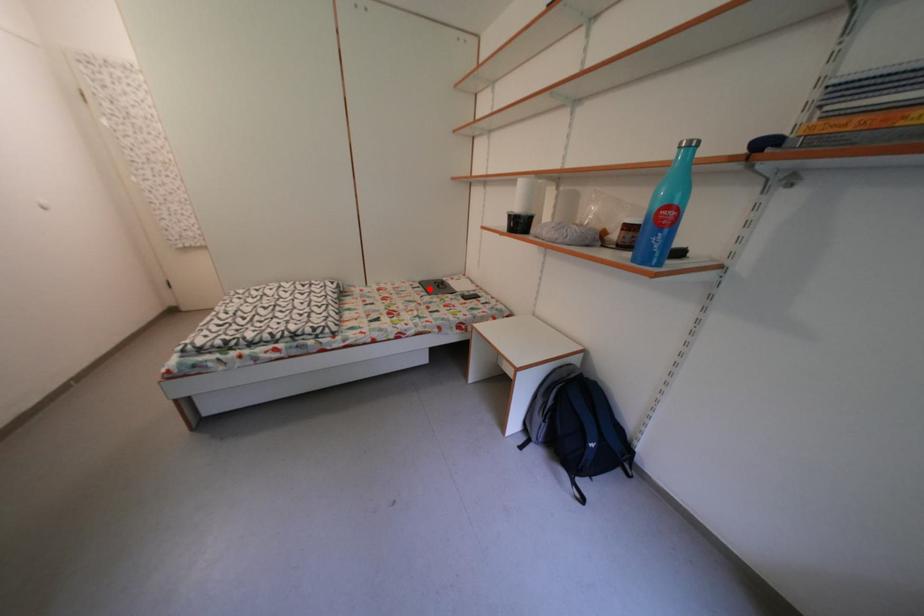
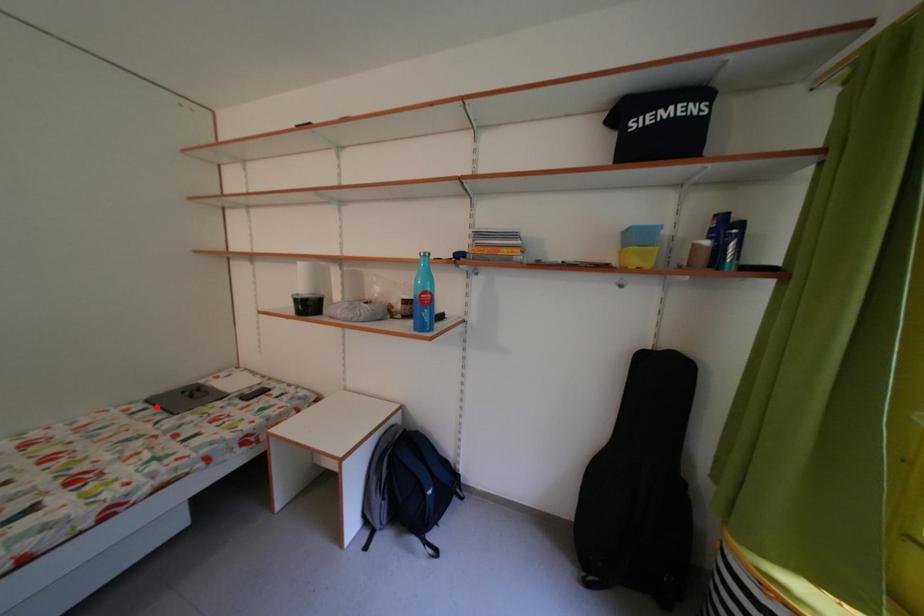
I am providing you with two images of the same scene from different viewpoints. A red point is marked on the first image and another point is marked on the second image. Is the marked point in image1 the same physical position as the marked point in image2?

Yes